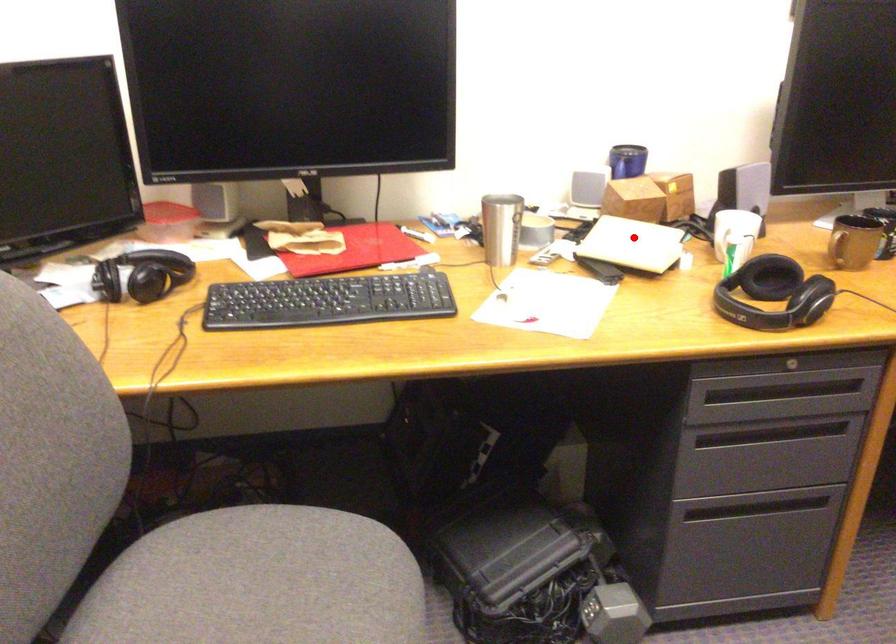
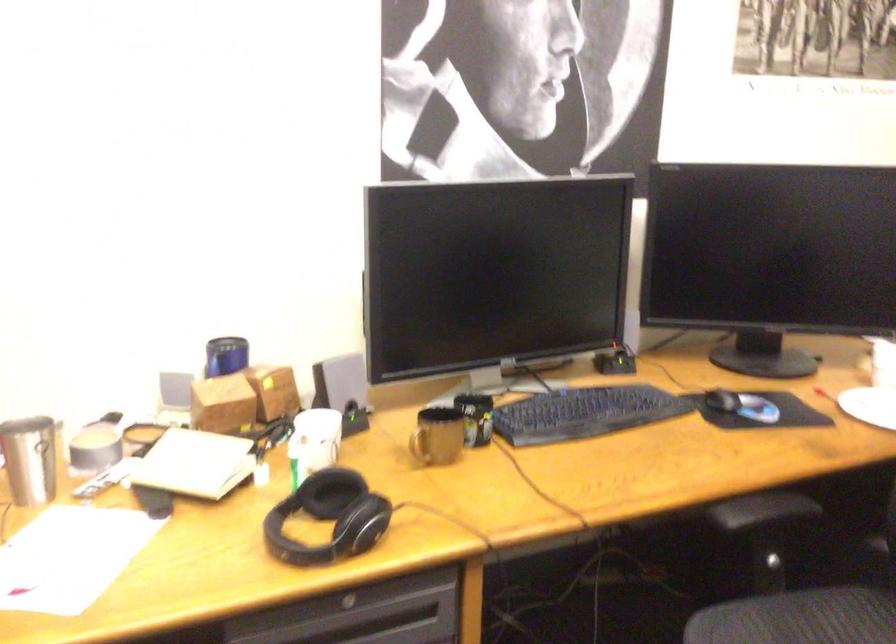
Question: I am providing you with two images of the same scene from different viewpoints. In image1, a red point is highlighted. Considering the same 3D point in image2, which of the following is correct?

Choices:
 (A) It is closer
 (B) It is farther

Answer: (A)